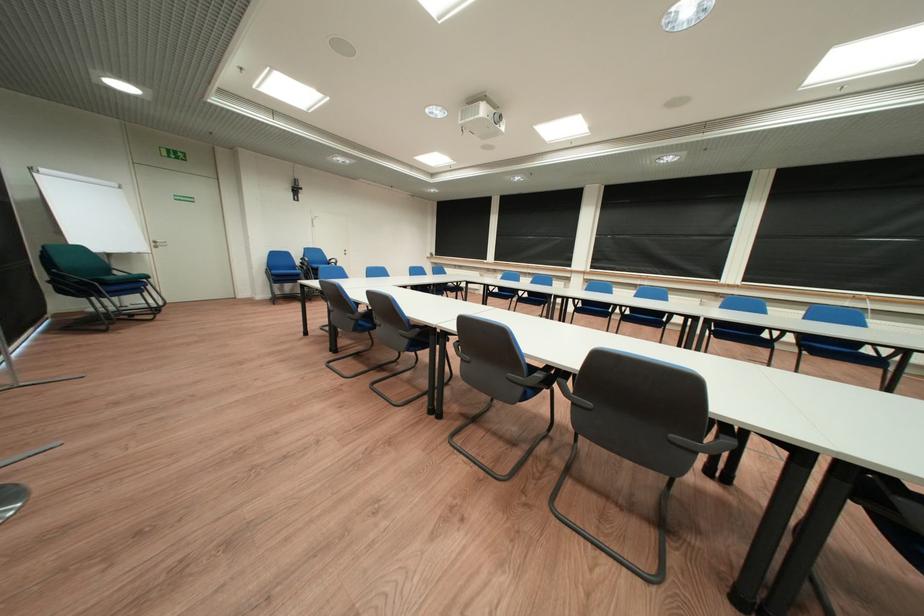
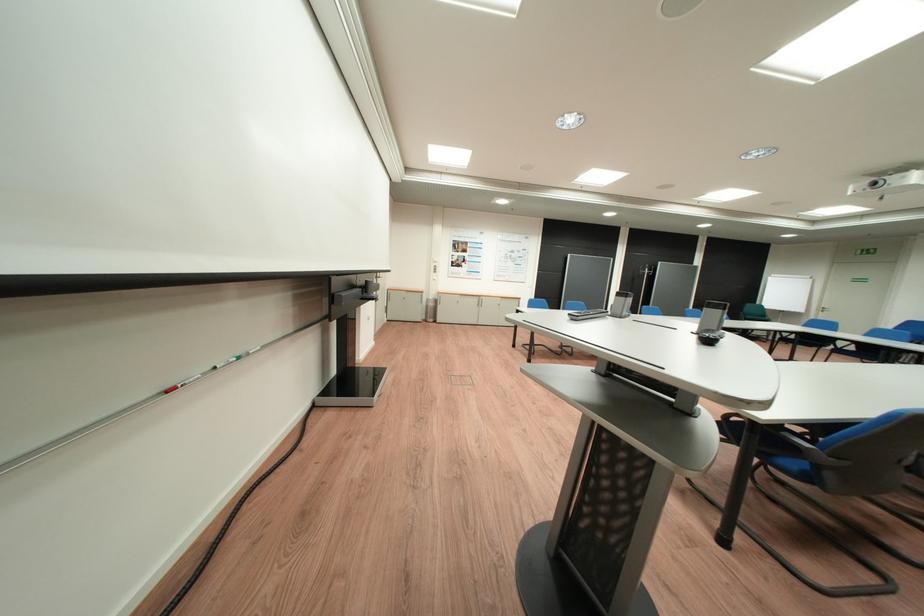
Question: I am providing you with two images of the same scene from different viewpoints. Please identify which objects are invisible in image2.

Choices:
 (A) blue chair sitting surface
 (B) blue suitcase
 (C) red whiteboard marker
 (D) black chair armrest

Answer: (D)